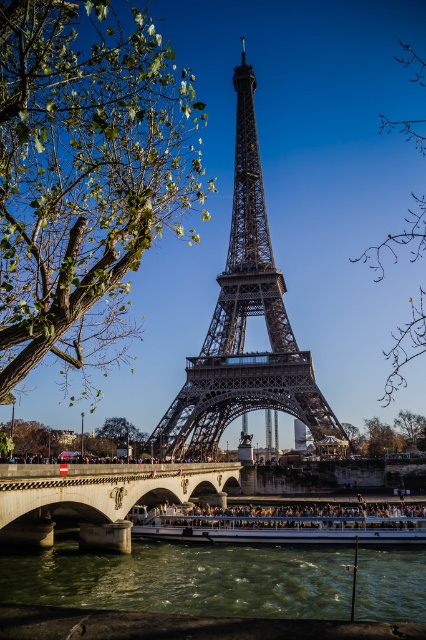
Is point (184, 588) positioned before point (48, 508)?

Yes, point (184, 588) is in front of point (48, 508).

Which of these two, green water at lower center or concrete bridge at center, stands taller?

Standing taller between the two is concrete bridge at center.

Between point (296, 566) and point (144, 481), which one is positioned behind?

The point (144, 481) is more distant.

I want to click on green water at lower center, so click(184, 579).

Can you confirm if green leafy tree at left is taller than brown leafy branches at upper right?

Indeed, green leafy tree at left has a greater height compared to brown leafy branches at upper right.

Is point (103, 221) positioned after point (367, 253)?

That is False.

At what (x,y) coordinates should I click in order to perform the action: click on green leafy tree at left. Please return your answer as a coordinate pair (x, y). Looking at the image, I should click on (85, 176).

Locate an element on the screen. concrete bridge at center is located at coordinates (101, 499).

From the picture: Is concrete bridge at center to the right of brown leafy branches at upper right from the viewer's perspective?

No, concrete bridge at center is not to the right of brown leafy branches at upper right.

Is point (169, 484) closer to viewer compared to point (373, 259)?

Yes.

Image resolution: width=426 pixels, height=640 pixels. I want to click on concrete bridge at center, so click(x=101, y=499).